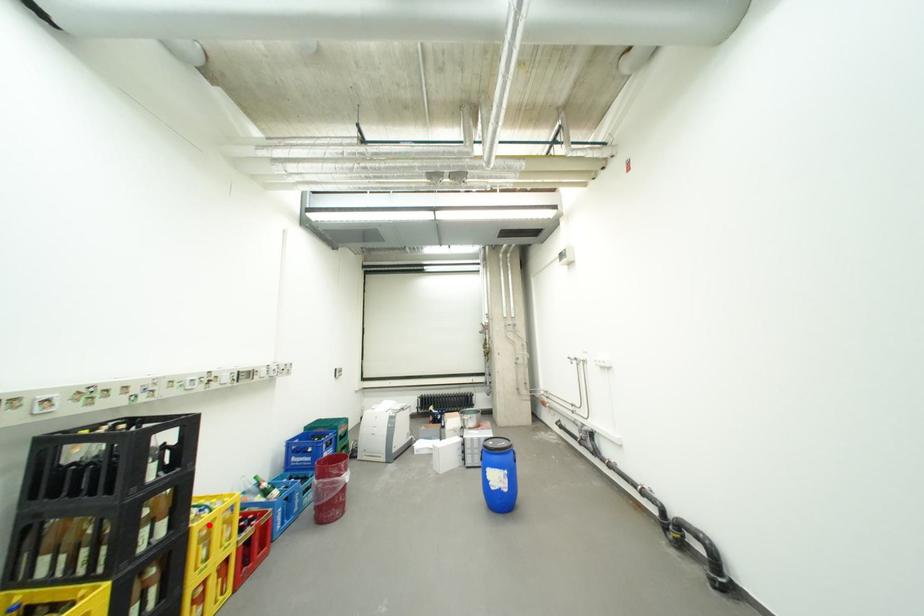
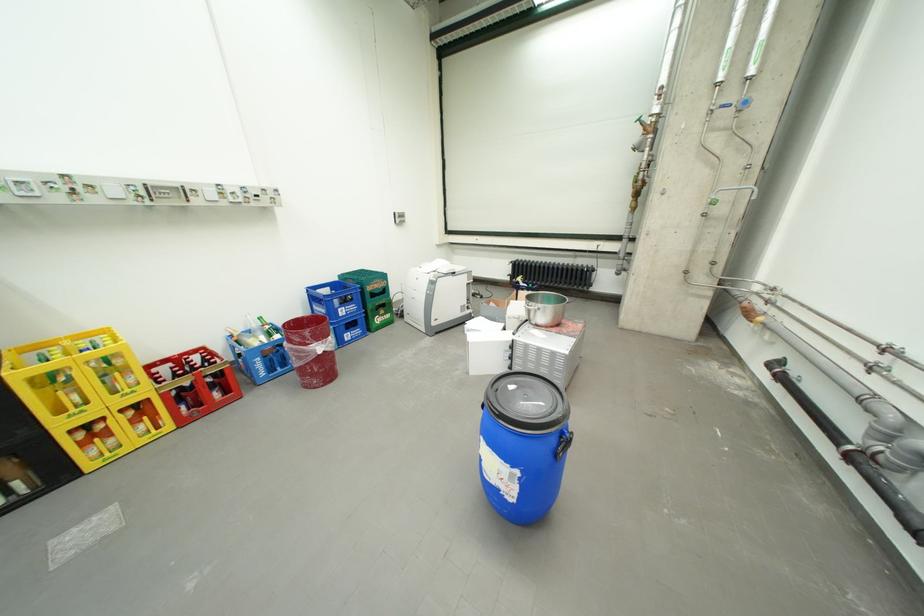
Question: I am providing you with two images of the same scene from different viewpoints. A red point is shown in image1. For the corresponding object point in image2, is it positioned nearer or farther from the camera?

Choices:
 (A) Nearer
 (B) Farther

Answer: (B)